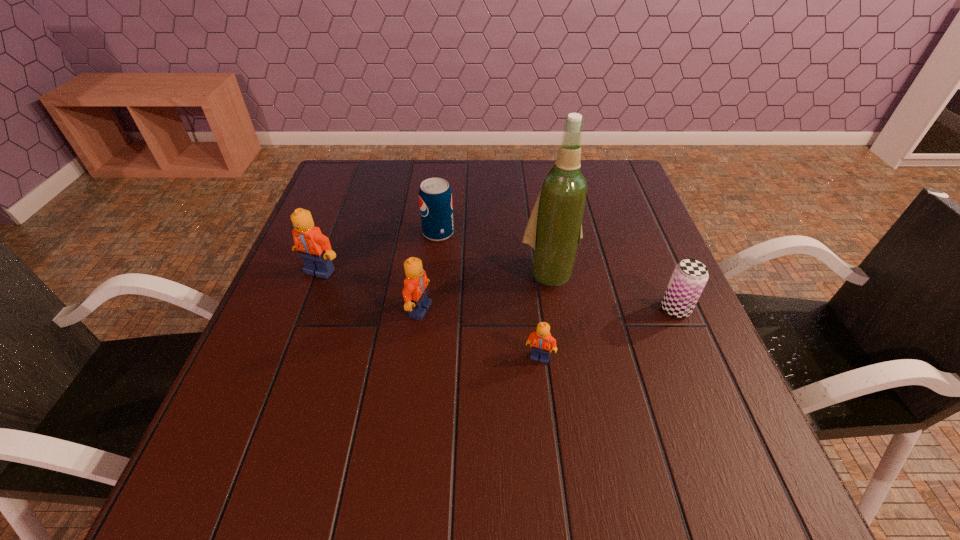
Where is `free point between the wine bottle and the leftmost object`? The image size is (960, 540). free point between the wine bottle and the leftmost object is located at coordinates (435, 272).

The image size is (960, 540). Identify the location of vacant area that lies between the farthest object and the leftmost Lego. (379, 252).

At what (x,y) coordinates should I click in order to perform the action: click on vacant area that lies between the pop and the tallest object. Please return your answer as a coordinate pair (x, y). Looking at the image, I should click on (494, 253).

Image resolution: width=960 pixels, height=540 pixels. Identify the location of free space that is in between the rightmost object and the second nearest Lego. (547, 309).

Locate an element on the screen. free space between the fifth tallest object and the second Lego from right to left is located at coordinates (547, 309).

Identify which object is the fifth nearest to the second Lego from right to left. Please provide its 2D coordinates. Your answer should be formatted as a tuple, i.e. [(x, y)], where the tuple contains the x and y coordinates of a point satisfying the conditions above.

[(690, 276)]

This screenshot has width=960, height=540. I want to click on object that can be found as the fifth closest to the wine bottle, so click(314, 248).

Identify which Lego is the third closest to the beer can. Please provide its 2D coordinates. Your answer should be formatted as a tuple, i.e. [(x, y)], where the tuple contains the x and y coordinates of a point satisfying the conditions above.

[(314, 248)]

Locate which Lego ranks in proximity to the second tallest Lego. Please provide its 2D coordinates. Your answer should be formatted as a tuple, i.e. [(x, y)], where the tuple contains the x and y coordinates of a point satisfying the conditions above.

[(314, 248)]

Find the location of a particular element. The width and height of the screenshot is (960, 540). vacant area in the image that satisfies the following two spatial constraints: 1. on the front-facing side of the beer can; 2. on the right side of the wine bottle is located at coordinates (556, 309).